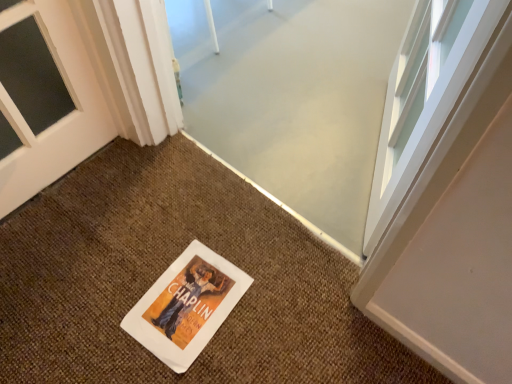
What do you see at coordinates (165, 269) in the screenshot? I see `white paper doormat at center` at bounding box center [165, 269].

Find the location of a particular element. The height and width of the screenshot is (384, 512). white paper doormat at center is located at coordinates (165, 269).

Locate an element on the screen. white paper flyer at center is located at coordinates (186, 306).

Image resolution: width=512 pixels, height=384 pixels. What do you see at coordinates (186, 306) in the screenshot?
I see `white paper flyer at center` at bounding box center [186, 306].

Identify the location of white paper doormat at center. (x=165, y=269).

Between white paper flyer at center and white paper doormat at center, which one appears on the left side from the viewer's perspective?

Positioned to the left is white paper flyer at center.

Is white paper flyer at center in front of or behind white paper doormat at center in the image?

white paper flyer at center is positioned farther from the viewer than white paper doormat at center.

Which is farther from the camera, [152,310] or [169,257]?

Point [169,257]

From the image's perspective, which object appears higher, white paper flyer at center or white paper doormat at center?

white paper flyer at center appears higher in the image.

From a real-world perspective, is white paper flyer at center above or below white paper doormat at center?

Clearly, from a real-world perspective, white paper flyer at center is above white paper doormat at center.

Looking at this image, is white paper flyer at center wider or thinner than white paper doormat at center?

In the image, white paper flyer at center appears to be more narrow than white paper doormat at center.

Is white paper flyer at center taller or shorter than white paper doormat at center?

white paper flyer at center is shorter than white paper doormat at center.

Who is bigger, white paper flyer at center or white paper doormat at center?

Bigger between the two is white paper doormat at center.

From the picture: Is white paper doormat at center surrounded by white paper flyer at center?

No, white paper doormat at center is located outside of white paper flyer at center.

Is white paper flyer at center positioned far away from white paper doormat at center?

No.

Is white paper flyer at center facing towards white paper doormat at center?

Yes, white paper flyer at center is aimed at white paper doormat at center.

How many degrees apart are the facing directions of white paper flyer at center and white paper doormat at center?

6.71 degrees.

Where is `doormat located underneath the white paper flyer at center (from a real-world perspective)`? doormat located underneath the white paper flyer at center (from a real-world perspective) is located at coordinates (165, 269).

Does white paper doormat at center appear on the right side of white paper flyer at center?

Indeed, white paper doormat at center is positioned on the right side of white paper flyer at center.

In the image, is white paper doormat at center positioned in front of or behind white paper flyer at center?

white paper doormat at center is in front of white paper flyer at center.

Between point (285, 341) and point (177, 361), which one is positioned in front?

Point (177, 361)

From the image's perspective, is white paper doormat at center positioned above or below white paper flyer at center?

white paper doormat at center is situated lower than white paper flyer at center in the image.

From a real-world perspective, which object stands above the other?

white paper flyer at center, from a real-world perspective.

In terms of width, does white paper doormat at center look wider or thinner when compared to white paper flyer at center?

Clearly, white paper doormat at center has more width compared to white paper flyer at center.

Is white paper doormat at center taller or shorter than white paper flyer at center?

In the image, white paper doormat at center appears to be taller than white paper flyer at center.

Who is smaller, white paper doormat at center or white paper flyer at center?

white paper flyer at center is smaller.

Is white paper flyer at center surrounded by white paper doormat at center?

Yes, white paper flyer at center is a part of white paper doormat at center.

Is white paper doormat at center not near white paper flyer at center?

No, white paper doormat at center is not far from white paper flyer at center.

Could you tell me if white paper doormat at center is facing white paper flyer at center?

Yes, white paper doormat at center is aimed at white paper flyer at center.

How different are the orientations of white paper doormat at center and white paper flyer at center in degrees?

6.71 degrees.

At what (x,y) coordinates should I click in order to perform the action: click on flyer behind the white paper doormat at center. Please return your answer as a coordinate pair (x, y). Looking at the image, I should click on (186, 306).

Locate an element on the screen. This screenshot has height=384, width=512. doormat lying below the white paper flyer at center (from the image's perspective) is located at coordinates (165, 269).

The width and height of the screenshot is (512, 384). What are the coordinates of `doormat below the white paper flyer at center (from a real-world perspective)` in the screenshot? It's located at (165, 269).